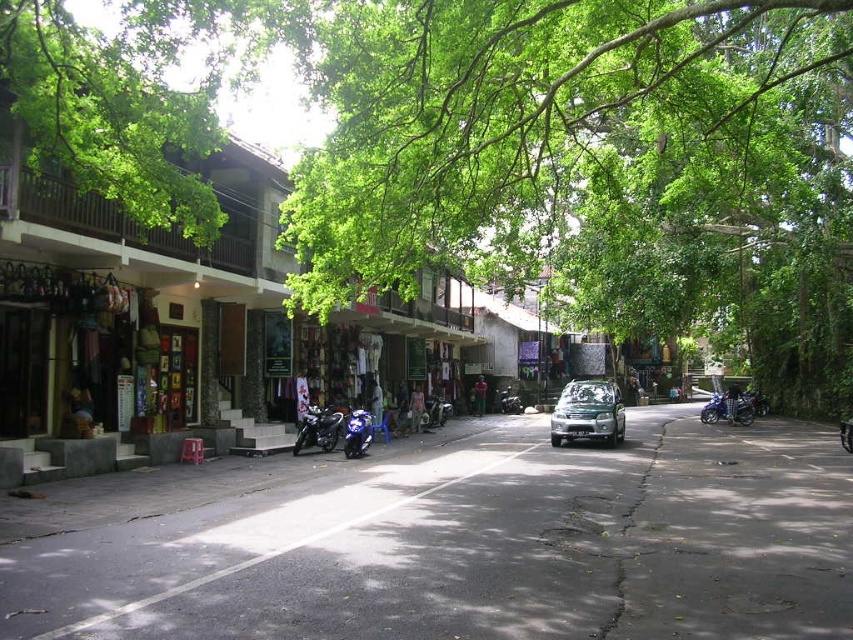
You are a delivery person trying to navigate through the street scene. You see a denim pants at center and a green fabric person at center. Which one is bigger in size?

The denim pants at center is larger in size compared to the green fabric person at center according to the description.

You are standing at the point marked by the coordinates point [376,403], which is the location of denim pants at center. If you turn to face the direction the silver car is moving, will you see the denim pants at center in your line of sight?

The point [376,403] marks the location of denim pants at center. Since the silver car is driving down the middle of the road, turning to face its direction would mean facing along the road. The denim pants at center are located at the marked point, which is likely along the road. Therefore, you would see the denim pants at center in your line of sight as you face the direction of the silver car.